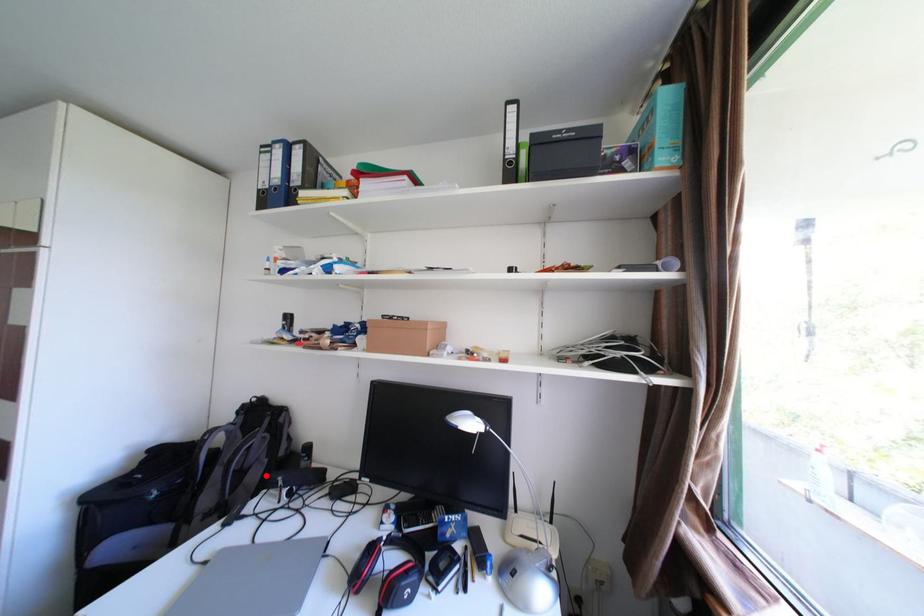
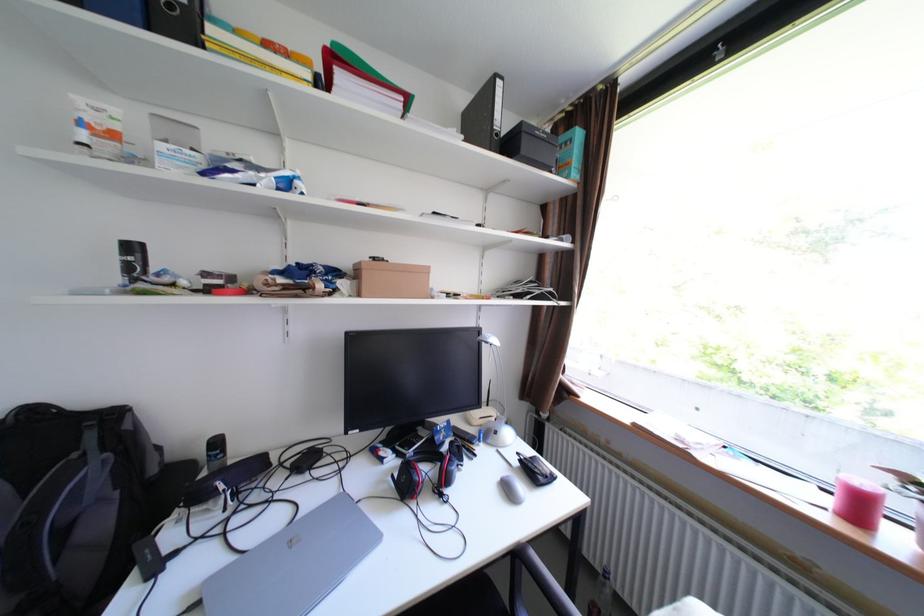
Question: A red point is marked in image1. In image2, is the corresponding 3D point closer to the camera or farther? Reply with the corresponding letter.

Choices:
 (A) The corresponding 3D point is closer.
 (B) The corresponding 3D point is farther.

Answer: (A)